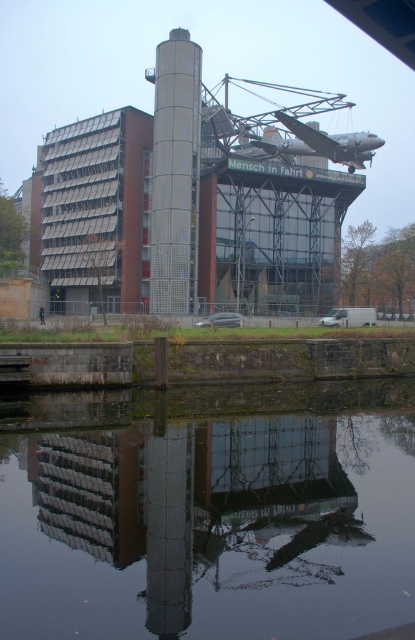
Question: Considering the relative positions of transparent glass water at center and gray metallic silo at center in the image provided, where is transparent glass water at center located with respect to gray metallic silo at center?

Choices:
 (A) left
 (B) right

Answer: (B)

Question: Observing the image, what is the correct spatial positioning of transparent glass water at center in reference to gray metallic silo at center?

Choices:
 (A) below
 (B) above

Answer: (A)

Question: Which of the following is the closest to the observer?

Choices:
 (A) transparent glass water at center
 (B) gray metallic silo at center

Answer: (A)

Question: Is transparent glass water at center above gray metallic silo at center?

Choices:
 (A) no
 (B) yes

Answer: (A)